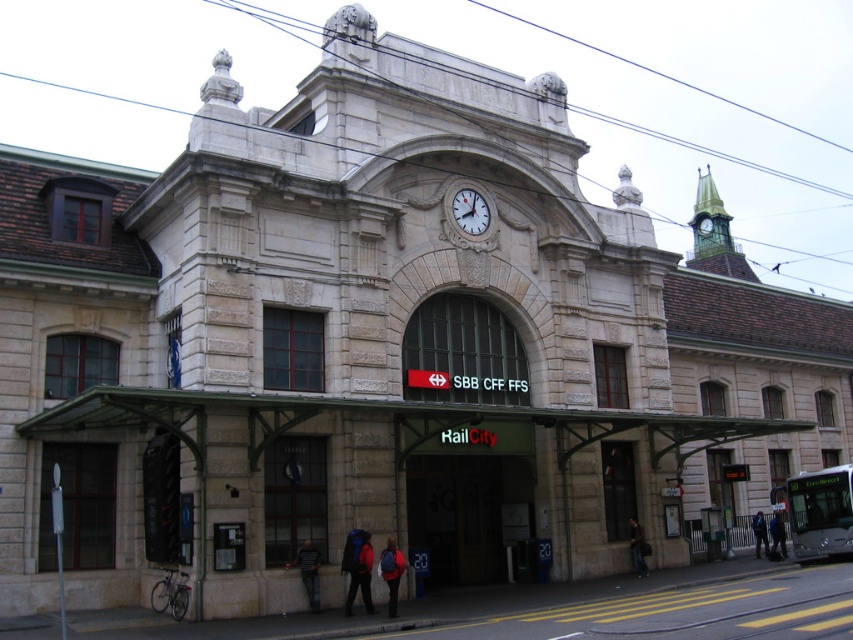
In the scene shown: You are standing at the historic train station in Switzerland. You notice two points marked on the facade. The first point is at coordinates point (473, 208) and the second is at point (395, 572). Which point is closer to you?

Point (473, 208) is closer to you because it is further to the viewer than point (395, 572).

You are a traveler standing in front of the historic train station. You see the white glossy clock at center and the red backpack at center. Which object is located to the left of the other?

The red backpack at center is located to the left of the white glossy clock at center.

You are a photographer standing at the historic train station. You want to capture both the stone railway station at center and the matte black backpack at lower center in a single photo. Considering their sizes, which object will appear bigger in the photo?

The stone railway station at center will appear bigger in the photo because it is larger in size than the matte black backpack at lower center.